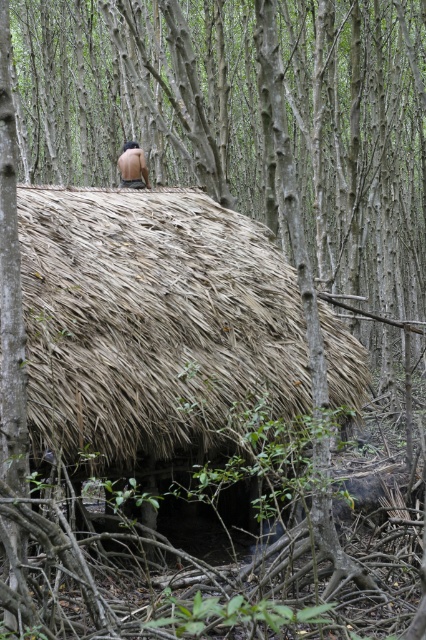
Question: Is brown thatch roof at center bigger than brown leather back at center?

Choices:
 (A) yes
 (B) no

Answer: (A)

Question: Does brown thatch roof at center have a larger size compared to brown leather back at center?

Choices:
 (A) yes
 (B) no

Answer: (A)

Question: Among these objects, which one is farthest from the camera?

Choices:
 (A) brown leather back at center
 (B) brown thatch roof at center

Answer: (A)

Question: Can you confirm if brown thatch roof at center is wider than brown leather back at center?

Choices:
 (A) yes
 (B) no

Answer: (A)